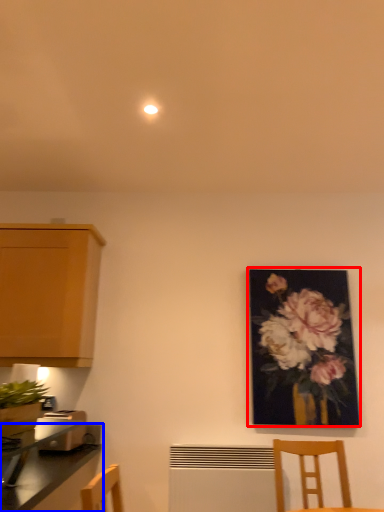
Question: Which object appears farthest to the camera in this image, picture frame (highlighted by a red box) or countertop (highlighted by a blue box)?

Choices:
 (A) picture frame
 (B) countertop

Answer: (A)